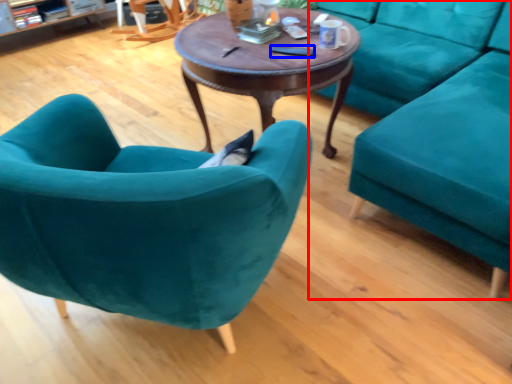
Question: Which point is further to the camera, studio couch (highlighted by a red box) or remote control (highlighted by a blue box)?

Choices:
 (A) studio couch
 (B) remote control

Answer: (B)